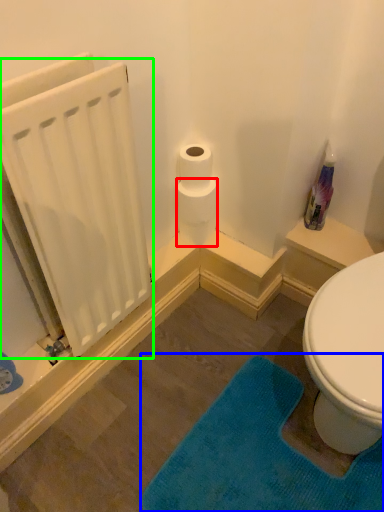
Question: Which object is the closest to the toilet paper (highlighted by a red box)? Choose among these: bath mat (highlighted by a blue box) or radiator (highlighted by a green box).

Choices:
 (A) bath mat
 (B) radiator

Answer: (B)